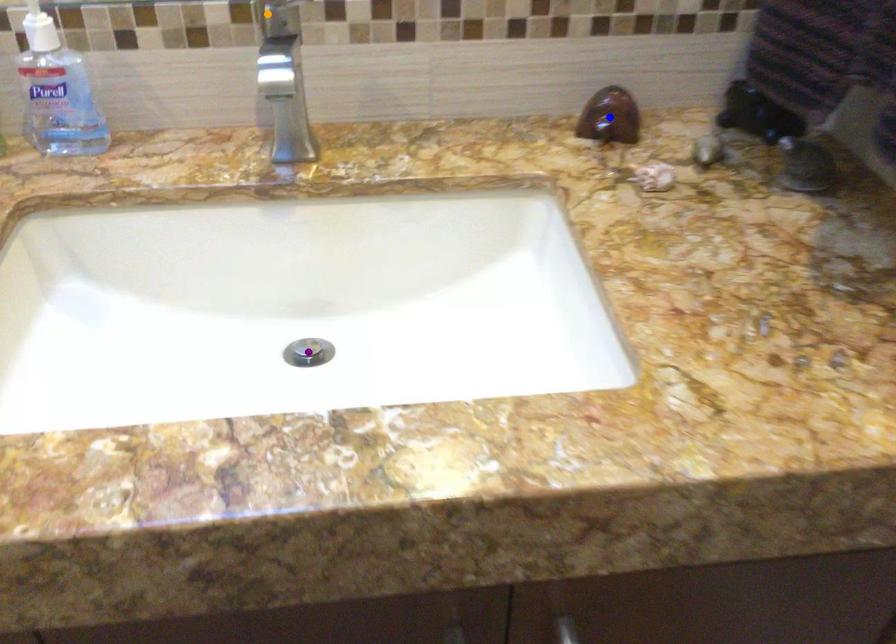
Order these from nearest to farthest:
blue point
purple point
orange point

orange point < purple point < blue point